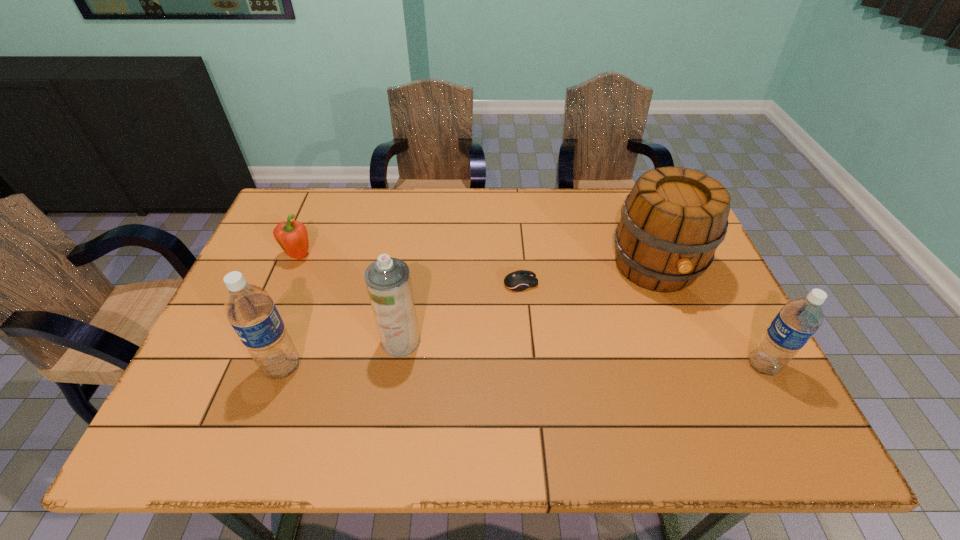
Locate an element on the screen. The image size is (960, 540). the left water bottle is located at coordinates (250, 310).

I want to click on the right water bottle, so click(799, 319).

In order to click on pepper in this screenshot , I will do `click(292, 237)`.

Identify the location of the shortest object. The width and height of the screenshot is (960, 540). (520, 280).

Locate an element on the screen. The width and height of the screenshot is (960, 540). computer mouse is located at coordinates (520, 280).

Find the location of a particular element. Image resolution: width=960 pixels, height=540 pixels. cider is located at coordinates point(673,220).

You are a GUI agent. You are given a task and a screenshot of the screen. Output one action in this format:
    pyautogui.click(x=<x>, y=<y>)
    Task: Click on the aerosol can
    The image size is (960, 540).
    Given the screenshot: What is the action you would take?
    pyautogui.click(x=388, y=281)

I want to click on free space located on the right of the left water bottle, so click(x=439, y=367).

Locate an element on the screen. free region located on the left of the right water bottle is located at coordinates (601, 365).

Image resolution: width=960 pixels, height=540 pixels. In order to click on blank space located on the front of the pepper in this screenshot , I will do `click(256, 358)`.